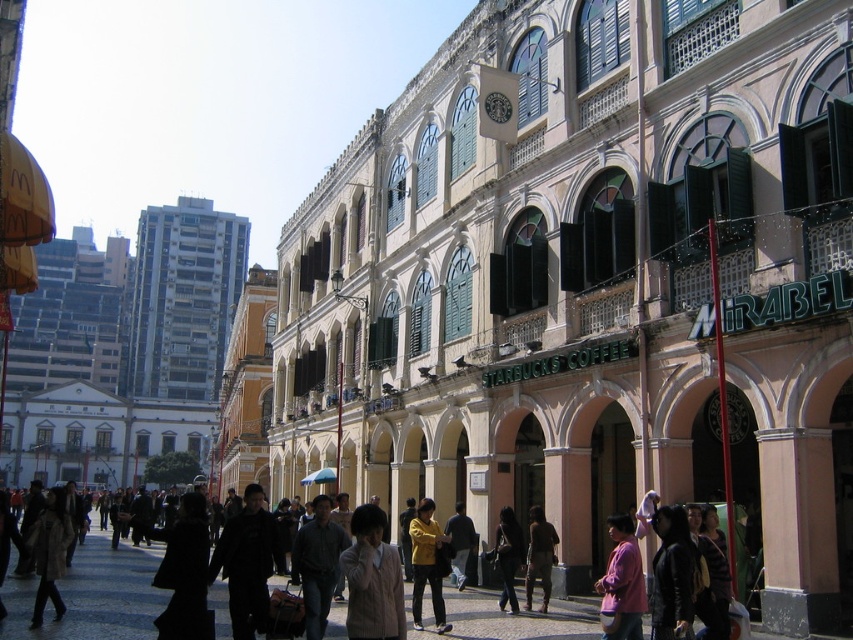
Does pink matte shirt at lower right appear on the left side of dark gray fabric jacket at center?

Incorrect, pink matte shirt at lower right is not on the left side of dark gray fabric jacket at center.

Does point (643, 611) lie behind point (517, 548)?

No, it is in front of (517, 548).

This screenshot has width=853, height=640. I want to click on pink matte shirt at lower right, so click(x=622, y=582).

Between pink matte shirt at lower right and brown leather pants at center, which one is positioned higher?

pink matte shirt at lower right is above.

Is point (630, 524) farther from viewer compared to point (538, 577)?

No, (630, 524) is in front of (538, 577).

Which is in front, point (624, 532) or point (548, 588)?

Positioned in front is point (624, 532).

The width and height of the screenshot is (853, 640). What are the coordinates of `pink matte shirt at lower right` in the screenshot? It's located at (622, 582).

Can you confirm if light beige sweater at center is positioned to the right of yellow matte jacket at center?

Incorrect, light beige sweater at center is not on the right side of yellow matte jacket at center.

Identify the location of light beige sweater at center. This screenshot has width=853, height=640. (x=372, y=579).